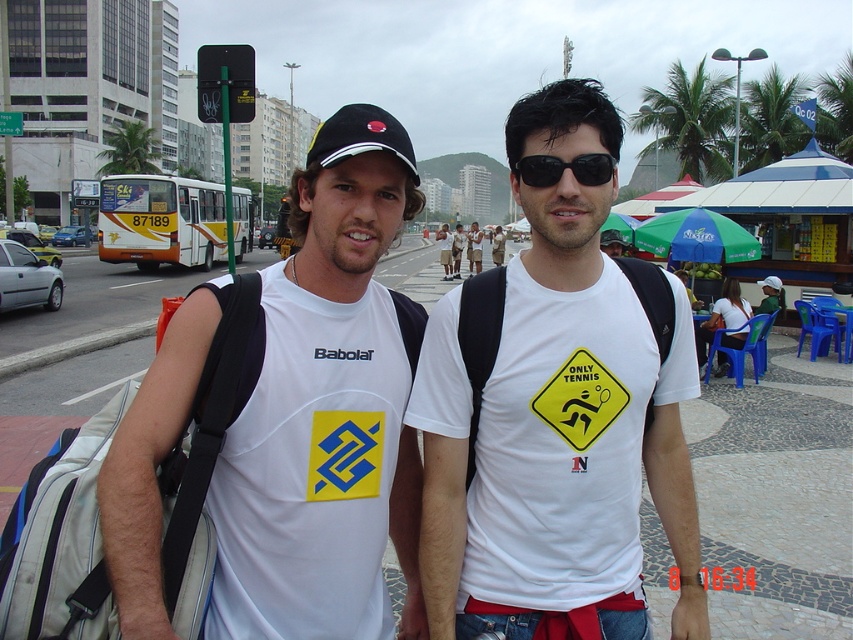
You are a pedestrian on the street. You see the black matte baseball cap at center and the green plastic traffic sign at upper center. Which object is closer to you?

The black matte baseball cap at center is closer to you because it is positioned under the green plastic traffic sign at upper center, meaning it is in front of the sign.

You are a photographer trying to capture a candid shot of the two people in the scene. You want to ensure that the black matte baseball cap at center and the white cotton shirts at center are both visible in the frame. Based on their positions, which object should you focus on first to include both in the shot?

The black matte baseball cap at center is to the left of white cotton shirts at center, so you should focus on the black matte baseball cap at center first to ensure both are in the frame.

You are a pedestrian trying to cross the street safely. You notice a black matte baseball cap at center and a green plastic traffic sign at upper center. Which object is closer to you, the observer?

The black matte baseball cap at center is closer to you than the green plastic traffic sign at upper center because they are 24.61 meters apart.